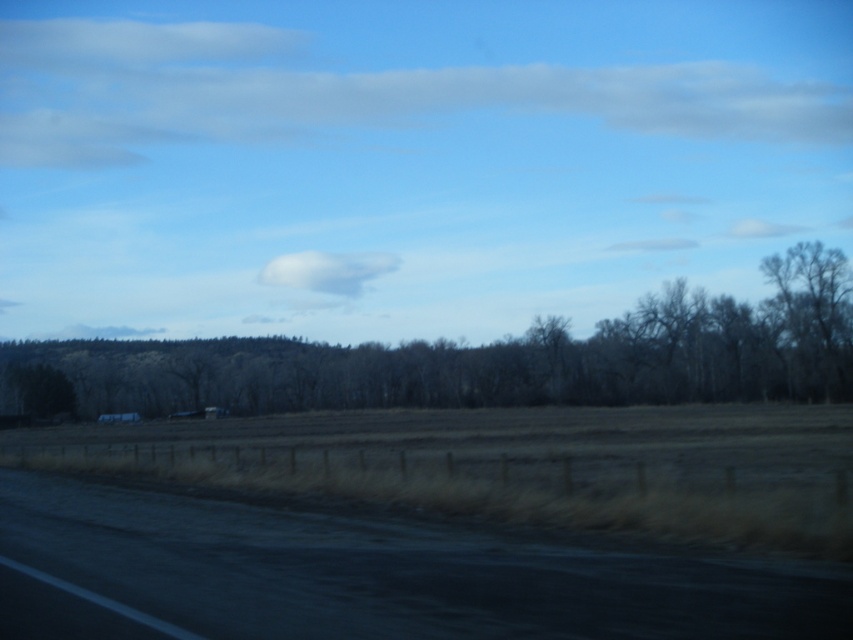
Between black asphalt road at lower left and white fluffy cloud at upper center, which one appears on the left side from the viewer's perspective?

white fluffy cloud at upper center is more to the left.

This screenshot has height=640, width=853. What are the coordinates of `black asphalt road at lower left` in the screenshot? It's located at [393, 572].

Between white fluffy cloud at upper center and white fluffy cloud at center, which one has more height?

With more height is white fluffy cloud at upper center.

Is point (769, 129) less distant than point (386, 262)?

No, (769, 129) is further to viewer.

At what (x,y) coordinates should I click in order to perform the action: click on white fluffy cloud at upper center. Please return your answer as a coordinate pair (x, y). Looking at the image, I should click on (344, 92).

Based on the photo, is brown/dry grass at center positioned at the back of white fluffy cloud at center?

No, it is not.

Who is lower down, brown/dry grass at center or white fluffy cloud at center?

brown/dry grass at center is lower down.

Who is more forward, (799, 365) or (270, 276)?

Point (799, 365) is in front.

Find the location of a particular element. This screenshot has height=640, width=853. brown/dry grass at center is located at coordinates (491, 358).